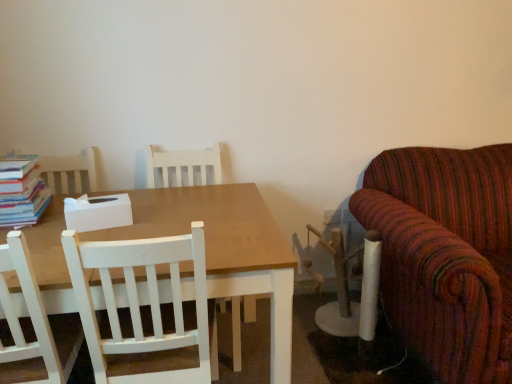
Question: Looking at the image, does white wood chair at center, marked as the first chair in a front-to-back arrangement, seem bigger or smaller compared to white wood chair at center, the first chair when ordered from back to front?

Choices:
 (A) big
 (B) small

Answer: (B)

Question: Does point (110, 246) appear closer or farther from the camera than point (252, 312)?

Choices:
 (A) farther
 (B) closer

Answer: (B)

Question: Considering the real-world distances, which object is farthest from the matte wooden table at center?

Choices:
 (A) white wood chair at center, the first chair when ordered from back to front
 (B) hardcover books at left
 (C) white wood chair at center, which is counted as the 2th chair, starting from the back

Answer: (A)

Question: Which of these objects is positioned closest to the white wood chair at center, marked as the first chair in a front-to-back arrangement?

Choices:
 (A) matte wooden table at center
 (B) hardcover books at left
 (C) white wood chair at center, the second chair positioned from the front

Answer: (A)